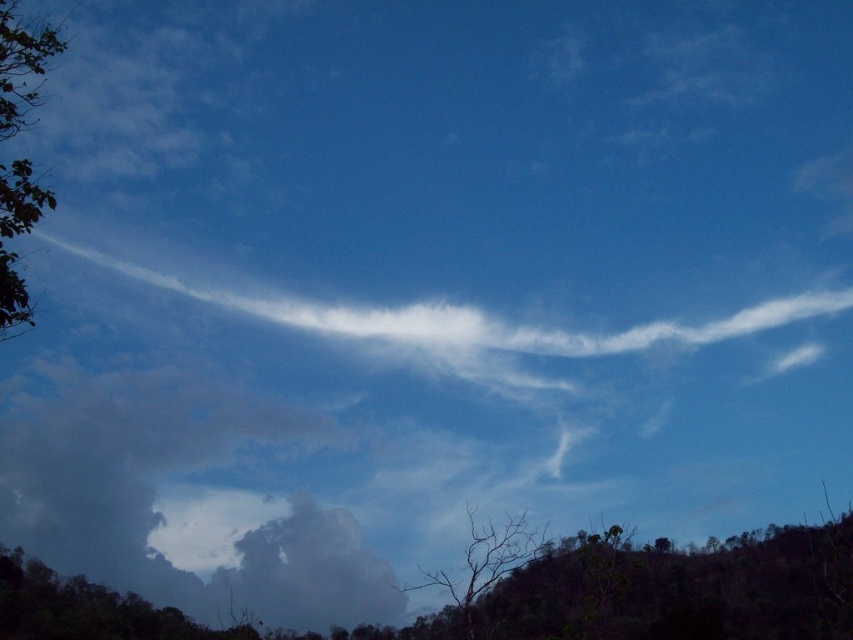
Question: Is green leafy tree at left bigger than bare wood tree at lower center?

Choices:
 (A) yes
 (B) no

Answer: (A)

Question: Which object is positioned farthest from the green leafy tree at left?

Choices:
 (A) bare wood tree at lower center
 (B) green leafy tree at lower left

Answer: (B)

Question: Can you confirm if green leafy tree at left is wider than bare wood tree at lower center?

Choices:
 (A) yes
 (B) no

Answer: (A)

Question: Is green leafy tree at left wider than bare wood tree at lower center?

Choices:
 (A) yes
 (B) no

Answer: (A)

Question: Which point is farther to the camera?

Choices:
 (A) green leafy tree at lower left
 (B) green leafy tree at left
 (C) bare wood tree at lower center

Answer: (A)

Question: Which object is positioned closest to the bare wood tree at lower center?

Choices:
 (A) green leafy tree at left
 (B) green leafy tree at lower left

Answer: (A)